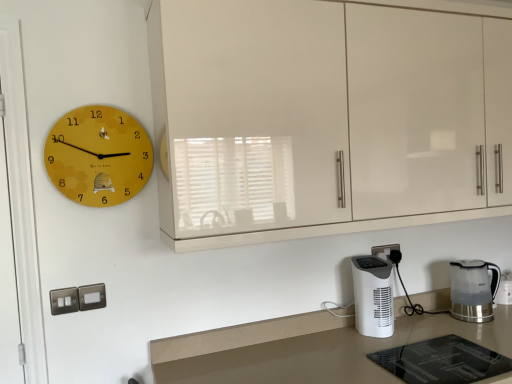
Question: Is white plastic electric outlet at lower right positioned behind yellow matte clock at upper left?

Choices:
 (A) no
 (B) yes

Answer: (B)

Question: Is the depth of white plastic electric outlet at lower right less than that of yellow matte clock at upper left?

Choices:
 (A) yes
 (B) no

Answer: (B)

Question: Is white plastic electric outlet at lower right facing towards yellow matte clock at upper left?

Choices:
 (A) no
 (B) yes

Answer: (A)

Question: Is white plastic electric outlet at lower right turned away from yellow matte clock at upper left?

Choices:
 (A) no
 (B) yes

Answer: (A)

Question: Considering the relative sizes of white plastic electric outlet at lower right and yellow matte clock at upper left in the image provided, is white plastic electric outlet at lower right bigger than yellow matte clock at upper left?

Choices:
 (A) yes
 (B) no

Answer: (B)

Question: Based on their positions, is transparent plastic kettle at lower right, acting as the second home appliance starting from the left, located to the left or right of glossy cream cabinetry at upper center?

Choices:
 (A) right
 (B) left

Answer: (A)

Question: Is point (489, 269) closer or farther from the camera than point (352, 6)?

Choices:
 (A) closer
 (B) farther

Answer: (B)

Question: From their relative heights in the image, would you say transparent plastic kettle at lower right, acting as the second home appliance starting from the left, is taller or shorter than glossy cream cabinetry at upper center?

Choices:
 (A) short
 (B) tall

Answer: (A)

Question: From the image's perspective, relative to glossy cream cabinetry at upper center, is transparent plastic kettle at lower right, acting as the second home appliance starting from the left, above or below?

Choices:
 (A) above
 (B) below

Answer: (B)

Question: From a real-world perspective, is yellow matte clock at upper left positioned above or below white glossy countertop at lower center?

Choices:
 (A) above
 (B) below

Answer: (A)

Question: Do you think yellow matte clock at upper left is within white glossy countertop at lower center, or outside of it?

Choices:
 (A) outside
 (B) inside

Answer: (A)

Question: Considering the positions of yellow matte clock at upper left and white glossy countertop at lower center in the image, is yellow matte clock at upper left bigger or smaller than white glossy countertop at lower center?

Choices:
 (A) small
 (B) big

Answer: (A)

Question: In the image, is yellow matte clock at upper left positioned in front of or behind white glossy countertop at lower center?

Choices:
 (A) behind
 (B) front

Answer: (A)

Question: From a real-world perspective, is glossy cream cabinetry at upper center physically located above or below white glossy countertop at lower center?

Choices:
 (A) above
 (B) below

Answer: (A)

Question: Considering the relative positions of glossy cream cabinetry at upper center and white glossy countertop at lower center in the image provided, is glossy cream cabinetry at upper center to the left or to the right of white glossy countertop at lower center?

Choices:
 (A) right
 (B) left

Answer: (B)